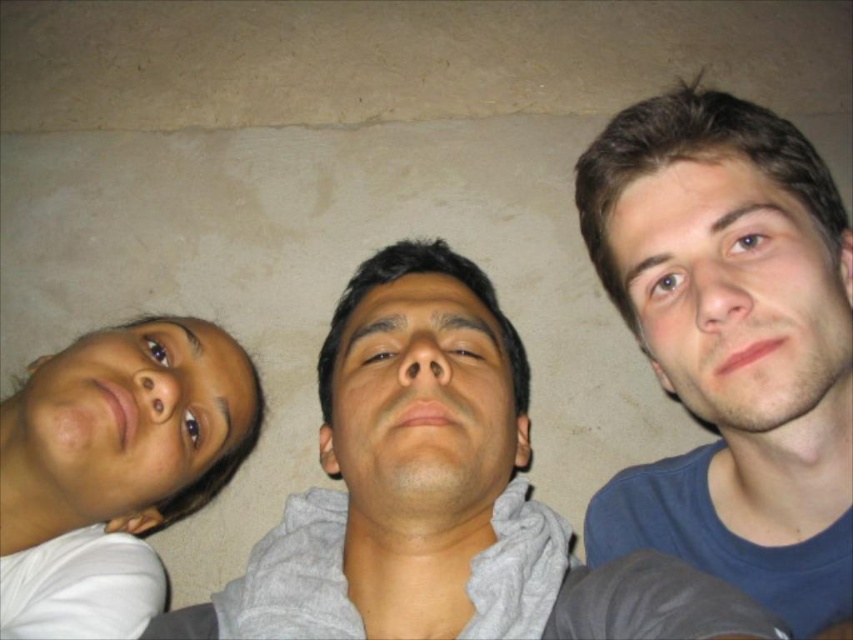
Which is more to the left, gray matte hoodie at center or matte skin face at left?

Positioned to the left is matte skin face at left.

You are a GUI agent. You are given a task and a screenshot of the screen. Output one action in this format:
    pyautogui.click(x=<x>, y=<y>)
    Task: Click on the gray matte hoodie at center
    
    Given the screenshot: What is the action you would take?
    pyautogui.click(x=440, y=493)

The image size is (853, 640). What are the coordinates of `gray matte hoodie at center` in the screenshot? It's located at (440, 493).

Between gray matte hoodie at center and smooth skin face at center, which one has more height?

gray matte hoodie at center

Does gray matte hoodie at center have a lesser height compared to smooth skin face at center?

No.

Identify the location of gray matte hoodie at center. (440, 493).

Find the location of `gray matte hoodie at center`. gray matte hoodie at center is located at coordinates (440, 493).

Who is shorter, smooth skin face at right or matte skin face at left?

smooth skin face at right

Measure the distance between smooth skin face at right and camera.

They are 21.43 inches apart.

Locate an element on the screen. Image resolution: width=853 pixels, height=640 pixels. smooth skin face at right is located at coordinates (735, 294).